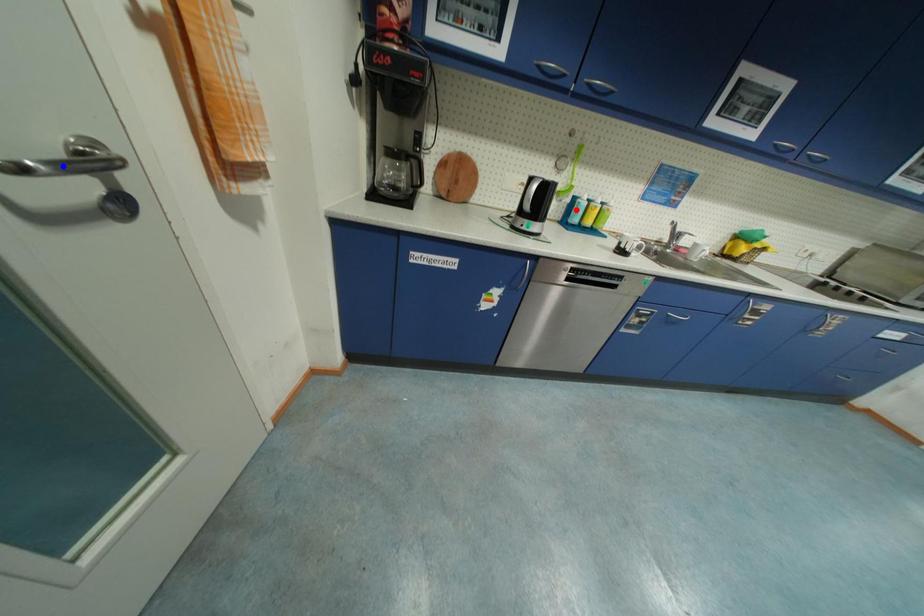
Question: Two points are marked on the image. Which point is closer to the camera?

Choices:
 (A) Blue point is closer.
 (B) Red point is closer.

Answer: (A)